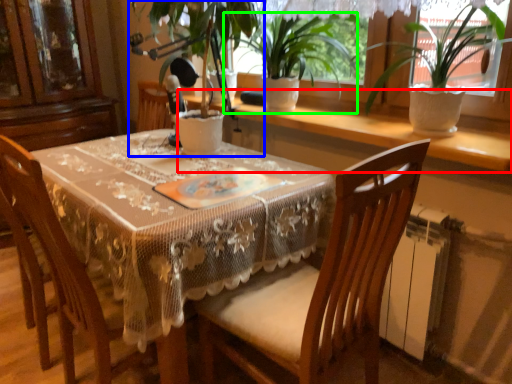
Question: Which object is positioned farthest from window sill (highlighted by a red box)? Select from houseplant (highlighted by a blue box) and houseplant (highlighted by a green box).

Choices:
 (A) houseplant
 (B) houseplant

Answer: (A)